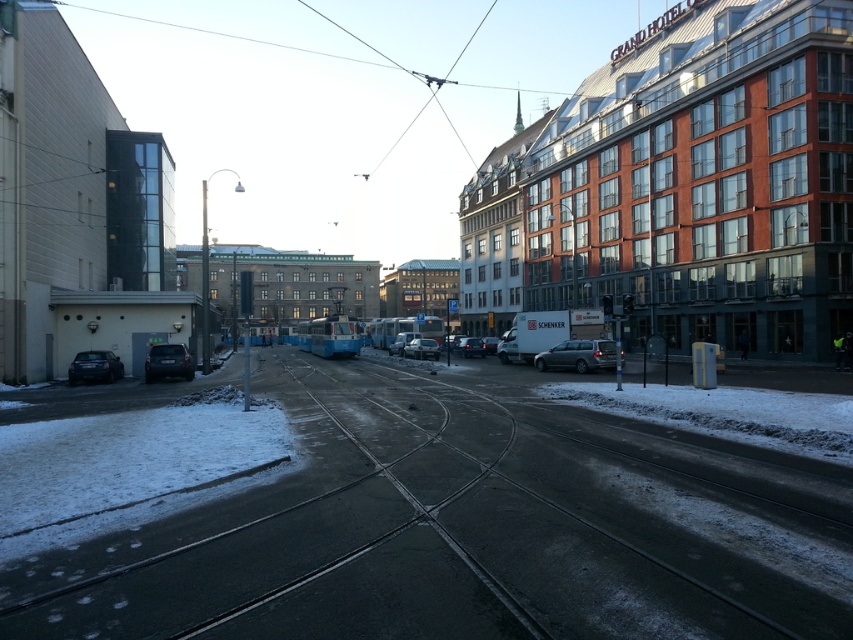
Question: From the image, what is the correct spatial relationship of smooth asphalt track at center in relation to matte white van at center?

Choices:
 (A) above
 (B) below

Answer: (B)

Question: Can you confirm if silver metallic car at center is wider than shiny black sedan at lower left?

Choices:
 (A) yes
 (B) no

Answer: (A)

Question: Does silver metallic car at center appear over shiny black sedan at lower left?

Choices:
 (A) yes
 (B) no

Answer: (A)

Question: Which of the following is the farthest from the observer?

Choices:
 (A) matte white van at center
 (B) satin silver sedan at center
 (C) silver metallic car at center
 (D) satin black car at lower left

Answer: (A)

Question: Which point is farther to the camera?

Choices:
 (A) smooth asphalt track at center
 (B) matte white van at center
 (C) satin black car at lower left

Answer: (B)

Question: Among these points, which one is farthest from the camera?

Choices:
 (A) (405, 353)
 (B) (96, 372)
 (C) (589, 362)
 (D) (467, 337)

Answer: (D)